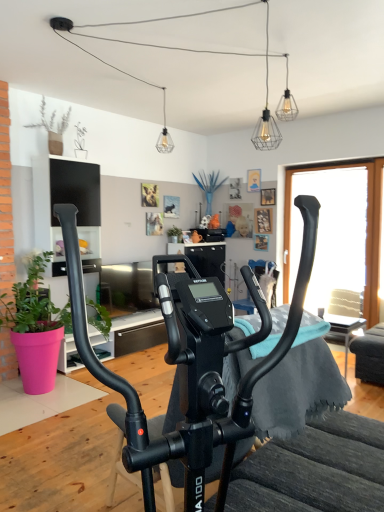
At what (x,y) coordinates should I click in order to perform the action: click on black matte stationary bicycle at center. Please return your answer as a coordinate pair (x, y). Looking at the image, I should click on (193, 362).

Describe the element at coordinates (331, 231) in the screenshot. I see `transparent glass window at right` at that location.

Measure the distance between clear glass pendant light at upper center, positioned as the 1th light fixture in back-to-front order, and camera.

clear glass pendant light at upper center, positioned as the 1th light fixture in back-to-front order, and camera are 4.28 meters apart.

Consider the image. How much space does clear glass pendant light at upper center, positioned as the 1th light fixture in back-to-front order, occupy horizontally?

It is 5.18 inches.

How much space does wire mesh bulb at upper center, which is the 3th light fixture from left to right, occupy horizontally?

It is 5.18 inches.

Where is `pink matte plant pot at left, acting as the second houseplant starting from the top`? The image size is (384, 512). pink matte plant pot at left, acting as the second houseplant starting from the top is located at coordinates (35, 327).

This screenshot has height=512, width=384. Identify the location of black matte stationary bicycle at center. (193, 362).

Is pink matte plant pot at left, which appears as the first houseplant when viewed from the front, positioned in front of black matte stationary bicycle at center?

No, the depth of pink matte plant pot at left, which appears as the first houseplant when viewed from the front, is greater than that of black matte stationary bicycle at center.

Is pink matte plant pot at left, acting as the second houseplant starting from the top, next to black matte stationary bicycle at center and touching it?

pink matte plant pot at left, acting as the second houseplant starting from the top, and black matte stationary bicycle at center are not in contact.

Would you say pink matte plant pot at left, the second houseplant viewed from the right, is to the left or to the right of black matte stationary bicycle at center in the picture?

Clearly, pink matte plant pot at left, the second houseplant viewed from the right, is on the left of black matte stationary bicycle at center in the image.

In terms of width, does pink matte plant pot at left, acting as the second houseplant starting from the top, look wider or thinner when compared to black matte stationary bicycle at center?

Clearly, pink matte plant pot at left, acting as the second houseplant starting from the top, has less width compared to black matte stationary bicycle at center.

Is wire mesh light fixture at upper center, the 3th light fixture when ordered from back to front, to the left or to the right of wire mesh bulb at upper center, which is the 3th light fixture from left to right, in the image?

wire mesh light fixture at upper center, the 3th light fixture when ordered from back to front, is positioned on wire mesh bulb at upper center, which is the 3th light fixture from left to right,'s left side.

This screenshot has width=384, height=512. Find the location of `the 2nd light fixture positioned below the wire mesh bulb at upper center, which is the 3th light fixture from left to right (from a real-world perspective)`. the 2nd light fixture positioned below the wire mesh bulb at upper center, which is the 3th light fixture from left to right (from a real-world perspective) is located at coordinates (266, 114).

From a real-world perspective, is wire mesh light fixture at upper center, acting as the second light fixture starting from the left, beneath wire mesh bulb at upper center, which is the 3th light fixture from left to right?

Indeed, from a real-world perspective, wire mesh light fixture at upper center, acting as the second light fixture starting from the left, is positioned beneath wire mesh bulb at upper center, which is the 3th light fixture from left to right.

Looking at this image, how different are the orientations of wire mesh light fixture at upper center, the 3th light fixture when ordered from back to front, and wire mesh bulb at upper center, the first light fixture from the right, in degrees?

There is a 90-degree angle between the facing directions of wire mesh light fixture at upper center, the 3th light fixture when ordered from back to front, and wire mesh bulb at upper center, the first light fixture from the right.

Are black matte stationary bicycle at center and green matte plant at center, positioned as the 2th houseplant in left-to-right order, making contact?

No, black matte stationary bicycle at center is not beside green matte plant at center, positioned as the 2th houseplant in left-to-right order.

Considering their positions, is black matte stationary bicycle at center located in front of or behind green matte plant at center, which is the first houseplant in back-to-front order?

In the image, black matte stationary bicycle at center appears in front of green matte plant at center, which is the first houseplant in back-to-front order.

Consider the image. In terms of size, does black matte stationary bicycle at center appear bigger or smaller than green matte plant at center, the 2th houseplant in the bottom-to-top sequence?

In the image, black matte stationary bicycle at center appears to be larger than green matte plant at center, the 2th houseplant in the bottom-to-top sequence.

Considering the relative sizes of wire mesh bulb at upper center, which is the 3th light fixture from left to right, and pink matte plant pot at left, which appears as the first houseplant when viewed from the front, in the image provided, is wire mesh bulb at upper center, which is the 3th light fixture from left to right, shorter than pink matte plant pot at left, which appears as the first houseplant when viewed from the front,?

Yes.

Is wire mesh bulb at upper center, which appears as the 2th light fixture when viewed from the front, facing towards pink matte plant pot at left, the second houseplant viewed from the right?

No, wire mesh bulb at upper center, which appears as the 2th light fixture when viewed from the front, is not oriented towards pink matte plant pot at left, the second houseplant viewed from the right.

Does wire mesh bulb at upper center, the 2th light fixture when ordered from back to front, have a larger size compared to pink matte plant pot at left, which is counted as the 1th houseplant, starting from the left?

No, wire mesh bulb at upper center, the 2th light fixture when ordered from back to front, is not bigger than pink matte plant pot at left, which is counted as the 1th houseplant, starting from the left.

Can you confirm if wire mesh bulb at upper center, the 2th light fixture when ordered from back to front, is thinner than pink matte plant pot at left, positioned as the 2th houseplant in back-to-front order?

Yes, wire mesh bulb at upper center, the 2th light fixture when ordered from back to front, is thinner than pink matte plant pot at left, positioned as the 2th houseplant in back-to-front order.

From the image's perspective, between wire mesh light fixture at upper center, acting as the second light fixture starting from the left, and clear glass pendant light at upper center, positioned as the 1th light fixture in back-to-front order, which one is located above?

clear glass pendant light at upper center, positioned as the 1th light fixture in back-to-front order, appears higher in the image.

From a real-world perspective, which object stands above the other?

clear glass pendant light at upper center, positioned as the 1th light fixture in back-to-front order.

Can you confirm if wire mesh light fixture at upper center, which is counted as the first light fixture, starting from the front, is taller than clear glass pendant light at upper center, arranged as the 1th light fixture when viewed from the left?

Indeed, wire mesh light fixture at upper center, which is counted as the first light fixture, starting from the front, has a greater height compared to clear glass pendant light at upper center, arranged as the 1th light fixture when viewed from the left.

Does wire mesh light fixture at upper center, acting as the second light fixture starting from the left, turn towards clear glass pendant light at upper center, marked as the third light fixture in a front-to-back arrangement?

No, wire mesh light fixture at upper center, acting as the second light fixture starting from the left, is not oriented towards clear glass pendant light at upper center, marked as the third light fixture in a front-to-back arrangement.

Does pink matte plant pot at left, the second houseplant viewed from the right, have a larger size compared to green matte plant at center, the 1th houseplant in the right-to-left sequence?

Indeed, pink matte plant pot at left, the second houseplant viewed from the right, has a larger size compared to green matte plant at center, the 1th houseplant in the right-to-left sequence.

Is pink matte plant pot at left, positioned as the 2th houseplant in back-to-front order, positioned beyond the bounds of green matte plant at center, which ranks as the 1th houseplant in top-to-bottom order?

That's correct, pink matte plant pot at left, positioned as the 2th houseplant in back-to-front order, is outside of green matte plant at center, which ranks as the 1th houseplant in top-to-bottom order.

Is pink matte plant pot at left, which appears as the first houseplant when viewed from the front, looking in the opposite direction of green matte plant at center, which ranks as the 1th houseplant in top-to-bottom order?

No, pink matte plant pot at left, which appears as the first houseplant when viewed from the front, is not facing the opposite direction of green matte plant at center, which ranks as the 1th houseplant in top-to-bottom order.

Would you consider pink matte plant pot at left, positioned as the 2th houseplant in back-to-front order, to be distant from green matte plant at center, which appears as the second houseplant when viewed from the front?

pink matte plant pot at left, positioned as the 2th houseplant in back-to-front order, is far away from green matte plant at center, which appears as the second houseplant when viewed from the front.

Which is correct: black matte stationary bicycle at center is inside pink matte plant pot at left, positioned as the 2th houseplant in back-to-front order, or outside of it?

black matte stationary bicycle at center is outside pink matte plant pot at left, positioned as the 2th houseplant in back-to-front order.

The width and height of the screenshot is (384, 512). Find the location of `houseplant that is the 2nd object to the left of the black matte stationary bicycle at center, starting at the anchor`. houseplant that is the 2nd object to the left of the black matte stationary bicycle at center, starting at the anchor is located at coordinates (35, 327).

Consider the image. From a real-world perspective, is black matte stationary bicycle at center positioned above or below pink matte plant pot at left, which ranks as the 1th houseplant in bottom-to-top order?

In terms of real-world spatial position, black matte stationary bicycle at center is above pink matte plant pot at left, which ranks as the 1th houseplant in bottom-to-top order.

You are a GUI agent. You are given a task and a screenshot of the screen. Output one action in this format:
    pyautogui.click(x=<x>, y=<y>)
    Task: Click on the stationary bicycle to the right of pink matte plant pot at left, which ranks as the 1th houseplant in bottom-to-top order
    Image resolution: width=384 pixels, height=512 pixels.
    Given the screenshot: What is the action you would take?
    pyautogui.click(x=193, y=362)

The height and width of the screenshot is (512, 384). What are the coordinates of `light fixture that is the 1st one when counting backward from the wire mesh light fixture at upper center, which ranks as the 2th light fixture in right-to-left order` in the screenshot? It's located at (286, 102).

In the scene shown: Estimate the real-world distances between objects in this image. Which object is further from wire mesh bulb at upper center, the first light fixture from the right, green matte plant at center, which is the first houseplant in back-to-front order, or transparent glass window at right?

Among the two, green matte plant at center, which is the first houseplant in back-to-front order, is located further to wire mesh bulb at upper center, the first light fixture from the right.

Estimate the real-world distances between objects in this image. Which object is further from wire mesh bulb at upper center, which appears as the 2th light fixture when viewed from the front, clear glass pendant light at upper center, marked as the third light fixture in a front-to-back arrangement, or transparent glass window at right?

Based on the image, transparent glass window at right appears to be further to wire mesh bulb at upper center, which appears as the 2th light fixture when viewed from the front.

Considering their positions, is transparent glass window at right positioned further to clear glass pendant light at upper center, which is counted as the third light fixture, starting from the right, than green matte plant at center, which appears as the second houseplant when viewed from the front?

transparent glass window at right.

Based on the photo, based on their spatial positions, is transparent glass window at right or wire mesh light fixture at upper center, acting as the second light fixture starting from the left, further from green matte plant at center, positioned as the 2th houseplant in left-to-right order?

transparent glass window at right.

Estimate the real-world distances between objects in this image. Which object is further from clear glass pendant light at upper center, positioned as the 1th light fixture in back-to-front order, green matte plant at center, the 1th houseplant in the right-to-left sequence, or wire mesh bulb at upper center, which is the 3th light fixture from left to right?

green matte plant at center, the 1th houseplant in the right-to-left sequence.

Which object lies nearer to the anchor point wire mesh bulb at upper center, the 2th light fixture when ordered from back to front, green matte plant at center, which ranks as the 1th houseplant in top-to-bottom order, or pink matte plant pot at left, which appears as the first houseplant when viewed from the front?

The object closer to wire mesh bulb at upper center, the 2th light fixture when ordered from back to front, is green matte plant at center, which ranks as the 1th houseplant in top-to-bottom order.

Considering their positions, is green matte plant at center, the 2th houseplant in the bottom-to-top sequence, positioned closer to pink matte plant pot at left, the second houseplant viewed from the right, than wire mesh bulb at upper center, the 2th light fixture when ordered from back to front?

green matte plant at center, the 2th houseplant in the bottom-to-top sequence, is closer to pink matte plant pot at left, the second houseplant viewed from the right.

Based on their spatial positions, is wire mesh bulb at upper center, the 2th light fixture when ordered from back to front, or transparent glass window at right further from wire mesh light fixture at upper center, which ranks as the 2th light fixture in right-to-left order?

The object further to wire mesh light fixture at upper center, which ranks as the 2th light fixture in right-to-left order, is transparent glass window at right.

This screenshot has width=384, height=512. Identify the location of window screen between wire mesh light fixture at upper center, the 3th light fixture when ordered from back to front, and green matte plant at center, positioned as the 2th houseplant in left-to-right order, along the z-axis. (331, 231).

Where is `light fixture between clear glass pendant light at upper center, arranged as the 1th light fixture when viewed from the left, and pink matte plant pot at left, which is counted as the 1th houseplant, starting from the left, in the up-down direction`? light fixture between clear glass pendant light at upper center, arranged as the 1th light fixture when viewed from the left, and pink matte plant pot at left, which is counted as the 1th houseplant, starting from the left, in the up-down direction is located at coordinates (266, 114).

This screenshot has width=384, height=512. Find the location of `houseplant between pink matte plant pot at left, acting as the second houseplant starting from the top, and transparent glass window at right from left to right`. houseplant between pink matte plant pot at left, acting as the second houseplant starting from the top, and transparent glass window at right from left to right is located at coordinates (174, 234).

This screenshot has width=384, height=512. In order to click on houseplant between clear glass pendant light at upper center, positioned as the 1th light fixture in back-to-front order, and transparent glass window at right from left to right in this screenshot , I will do `click(174, 234)`.